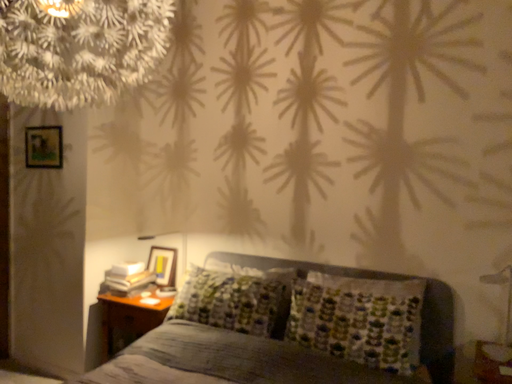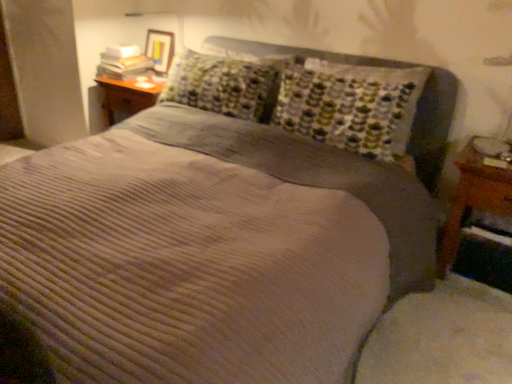
Question: How did the camera likely rotate when shooting the video?

Choices:
 (A) rotated upward
 (B) rotated downward

Answer: (B)